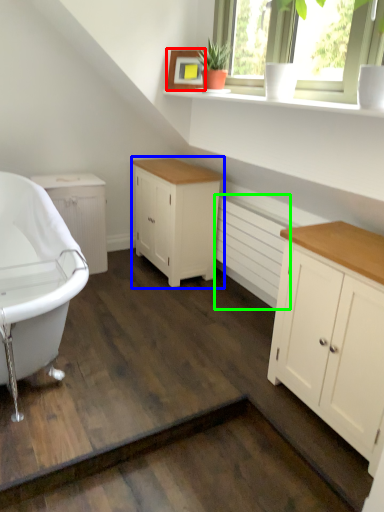
Question: Which is farther away from picture frame (highlighted by a red box)? cabinetry (highlighted by a blue box) or radiator (highlighted by a green box)?

Choices:
 (A) cabinetry
 (B) radiator

Answer: (B)